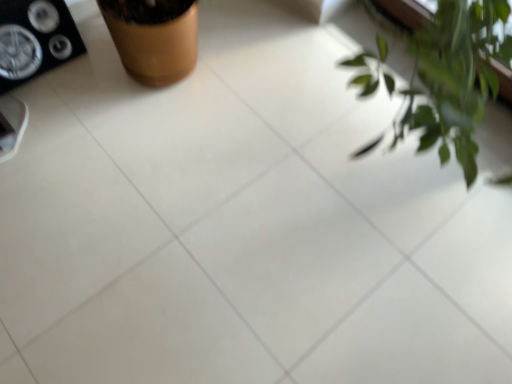
Locate an element on the screen. The width and height of the screenshot is (512, 384). metallic silver speaker at upper left is located at coordinates coord(35,39).

This screenshot has width=512, height=384. What do you see at coordinates (35, 39) in the screenshot? I see `metallic silver speaker at upper left` at bounding box center [35, 39].

The height and width of the screenshot is (384, 512). Identify the location of metallic silver speaker at upper left. (35, 39).